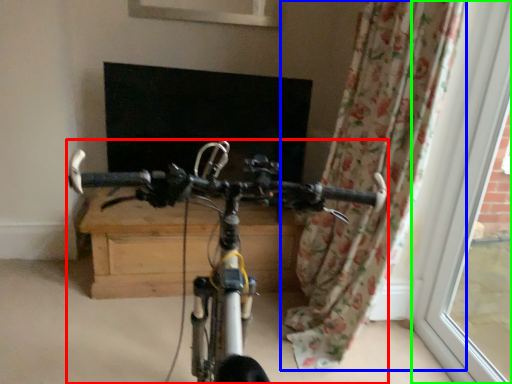
Question: Which object is the closest to the bicycle (highlighted by a red box)? Choose among these: curtain (highlighted by a blue box) or window frame (highlighted by a green box).

Choices:
 (A) curtain
 (B) window frame

Answer: (A)